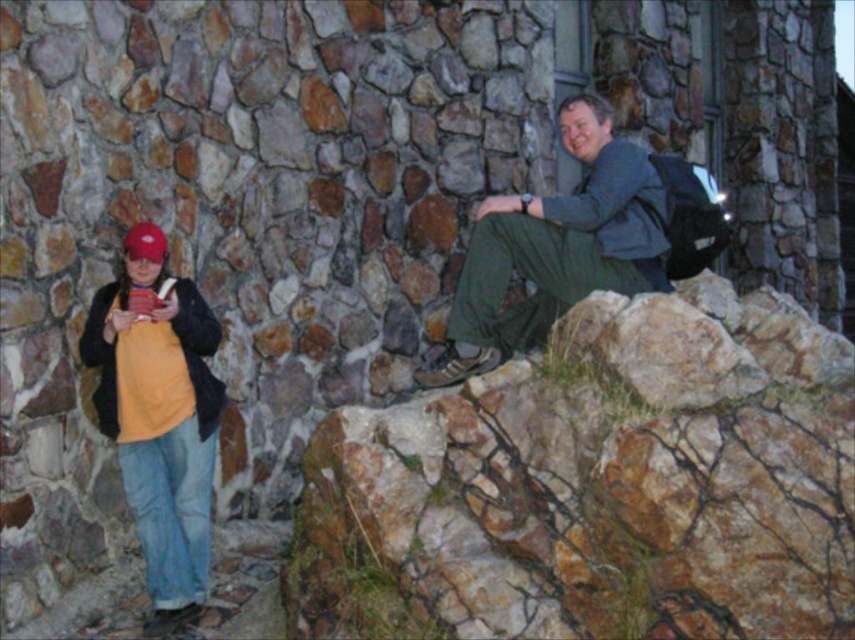
You are standing in the scene and want to locate the dark green fabric pants at upper right. What are their coordinates?

The dark green fabric pants at upper right are located at coordinates (556,248).

Based on the photo, you are standing in front of the stone wall and see the matte yellow shirt at left and the dark green fabric pants at upper right. Which object is positioned farther to the left?

The matte yellow shirt at left is positioned farther to the left than the dark green fabric pants at upper right.

You are standing in front of the stone wall and want to take a photo of the matte yellow shirt at left and the dark green fabric pants at upper right. Which one is closer to you?

The matte yellow shirt at left is closer to you than the dark green fabric pants at upper right.